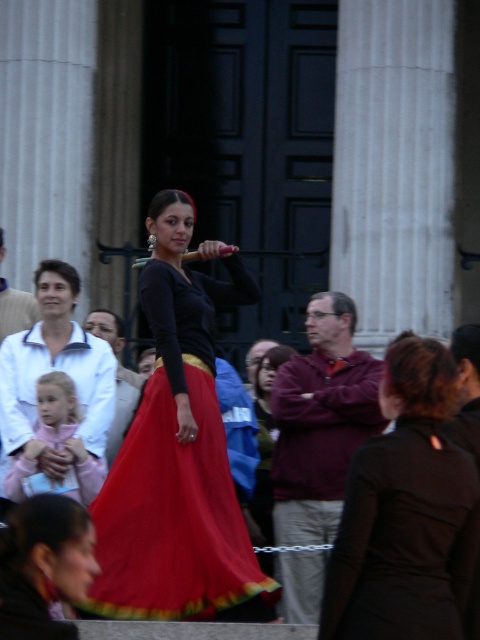
Question: Does black fabric skirt at center come in front of matte pink dress at lower left?

Choices:
 (A) yes
 (B) no

Answer: (A)

Question: Estimate the real-world distances between objects in this image. Which object is farther from the matte pink dress at lower left?

Choices:
 (A) black fabric skirt at center
 (B) matte black top at center
 (C) matte white jacket at left
 (D) maroon fleece jacket at center

Answer: (A)

Question: Does black fabric skirt at center appear under matte pink dress at lower left?

Choices:
 (A) yes
 (B) no

Answer: (A)

Question: Which of the following is the closest to the observer?

Choices:
 (A) (100, 436)
 (B) (323, 449)

Answer: (A)

Question: Which of the following is the closest to the observer?

Choices:
 (A) matte black top at center
 (B) maroon fleece jacket at center
 (C) silky red skirt at center
 (D) matte white jacket at left

Answer: (C)

Question: Can you confirm if matte black top at center is bigger than silky red skirt at center?

Choices:
 (A) yes
 (B) no

Answer: (A)